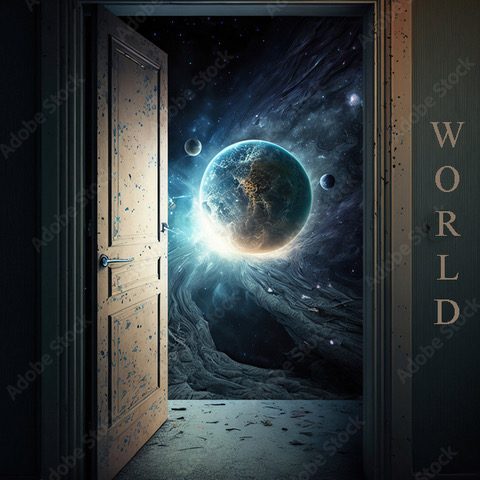
You are a GUI agent. You are given a task and a screenshot of the screen. Output one action in this format:
    pyautogui.click(x=<x>, y=<y>)
    Task: Click on the wall
    Image resolution: width=480 pixels, height=480 pixels.
    Given the screenshot: What is the action you would take?
    pyautogui.click(x=447, y=364), pyautogui.click(x=18, y=224)